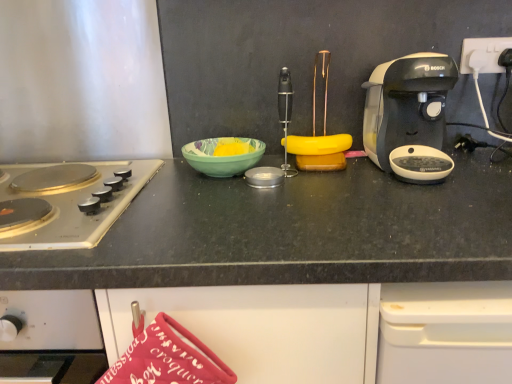
Question: Is green glossy bowl at center a part of white plastic power outlet at upper right?

Choices:
 (A) no
 (B) yes

Answer: (A)

Question: Does white plastic power outlet at upper right have a lesser width compared to green glossy bowl at center?

Choices:
 (A) no
 (B) yes

Answer: (B)

Question: From a real-world perspective, is white plastic power outlet at upper right beneath green glossy bowl at center?

Choices:
 (A) yes
 (B) no

Answer: (B)

Question: Is white plastic power outlet at upper right shorter than green glossy bowl at center?

Choices:
 (A) yes
 (B) no

Answer: (B)

Question: Considering the relative positions of white plastic power outlet at upper right and green glossy bowl at center in the image provided, is white plastic power outlet at upper right to the right of green glossy bowl at center from the viewer's perspective?

Choices:
 (A) yes
 (B) no

Answer: (A)

Question: Is silver/golden metallic gas stove at left bigger or smaller than black plastic coffee maker at right?

Choices:
 (A) big
 (B) small

Answer: (A)

Question: Would you say silver/golden metallic gas stove at left is to the left or to the right of black plastic coffee maker at right in the picture?

Choices:
 (A) right
 (B) left

Answer: (B)

Question: In terms of height, does silver/golden metallic gas stove at left look taller or shorter compared to black plastic coffee maker at right?

Choices:
 (A) tall
 (B) short

Answer: (B)

Question: Is point click(14, 230) positioned closer to the camera than point click(388, 155)?

Choices:
 (A) farther
 (B) closer

Answer: (B)

Question: Is silver/golden metallic gas stove at left to the left or to the right of green glossy bowl at center in the image?

Choices:
 (A) left
 (B) right

Answer: (A)

Question: Is silver/golden metallic gas stove at left taller or shorter than green glossy bowl at center?

Choices:
 (A) tall
 (B) short

Answer: (A)

Question: From a real-world perspective, is silver/golden metallic gas stove at left above or below green glossy bowl at center?

Choices:
 (A) above
 (B) below

Answer: (B)

Question: Looking at the image, does silver/golden metallic gas stove at left seem bigger or smaller compared to green glossy bowl at center?

Choices:
 (A) big
 (B) small

Answer: (A)

Question: Is green glossy bowl at center in front of or behind white plastic power outlet at upper right in the image?

Choices:
 (A) behind
 (B) front

Answer: (B)

Question: In terms of size, does green glossy bowl at center appear bigger or smaller than white plastic power outlet at upper right?

Choices:
 (A) small
 (B) big

Answer: (B)